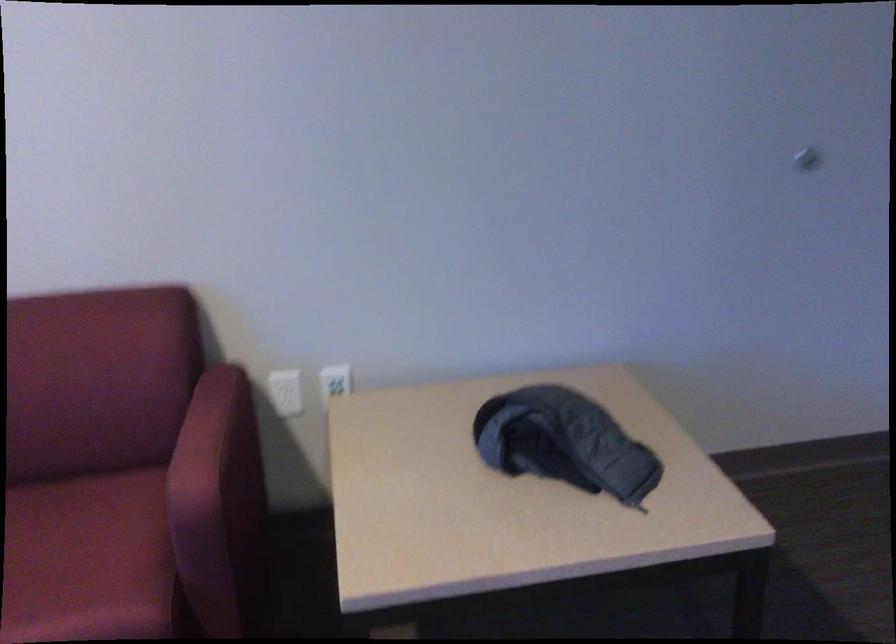
What do you see at coordinates (204, 504) in the screenshot? I see `a chair armrest` at bounding box center [204, 504].